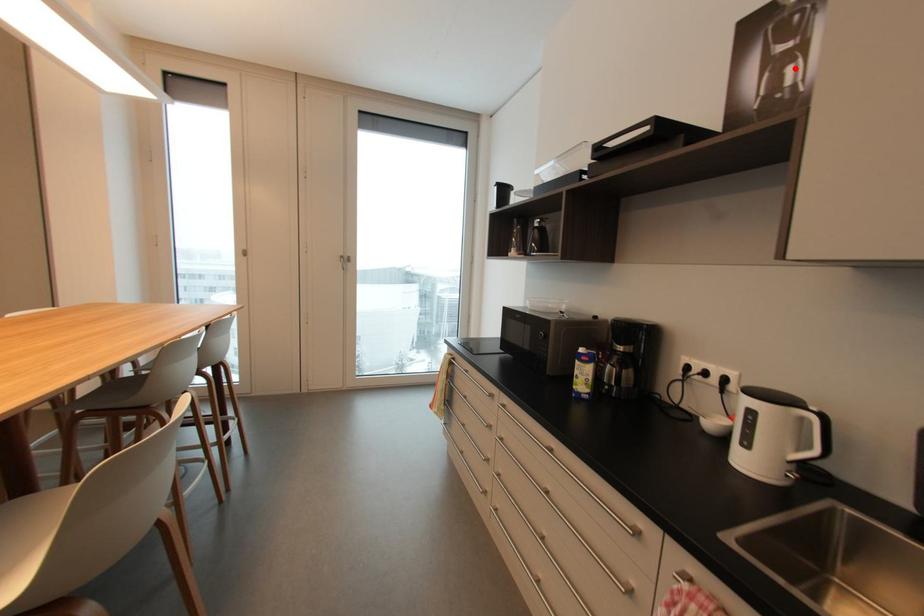
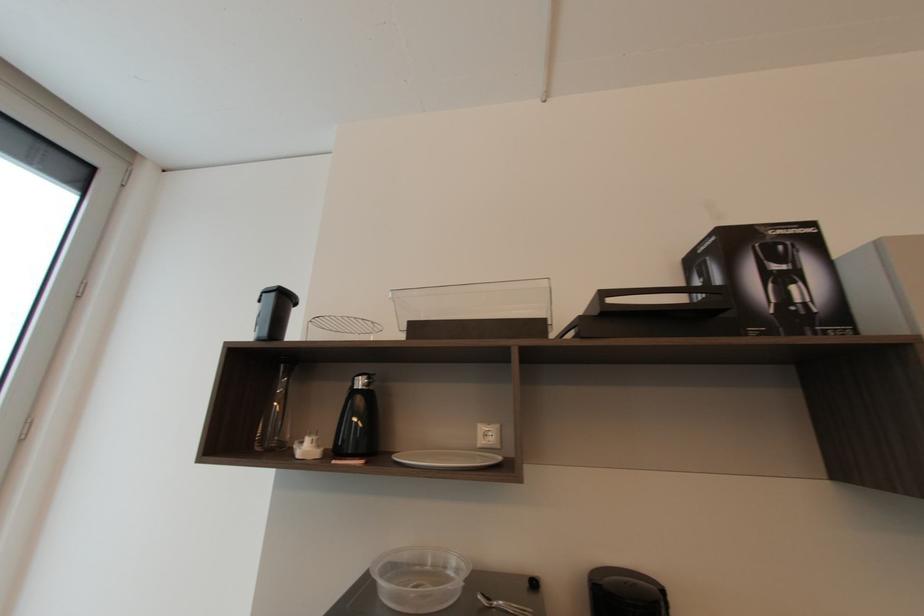
Find the pixel in the second image that matches the highlighted location in the first image.

(796, 288)